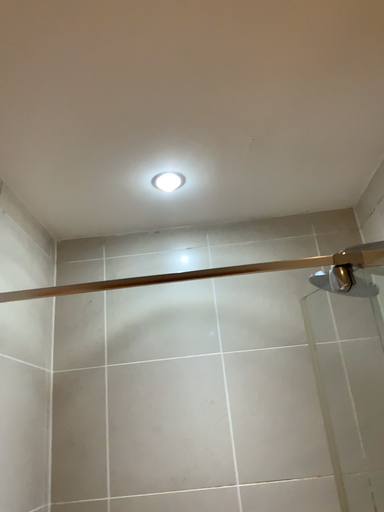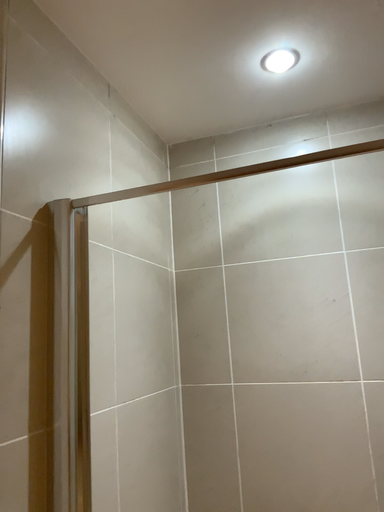
Question: Which way did the camera rotate in the video?

Choices:
 (A) rotated right
 (B) rotated left

Answer: (B)